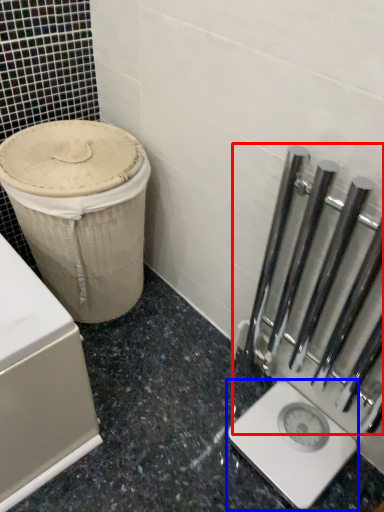
Question: Among these objects, which one is farthest to the camera, rail (highlighted by a red box) or scale (highlighted by a blue box)?

Choices:
 (A) rail
 (B) scale

Answer: (B)